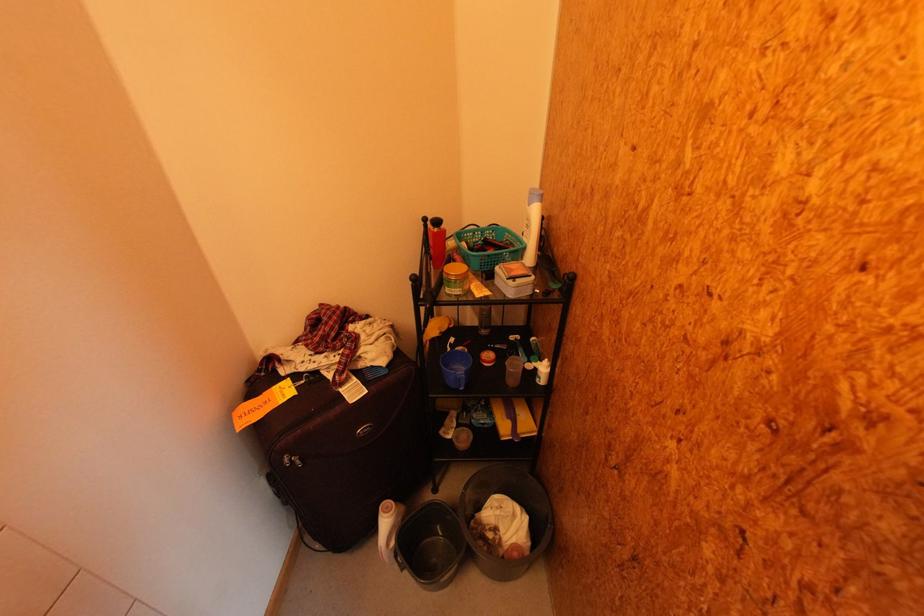
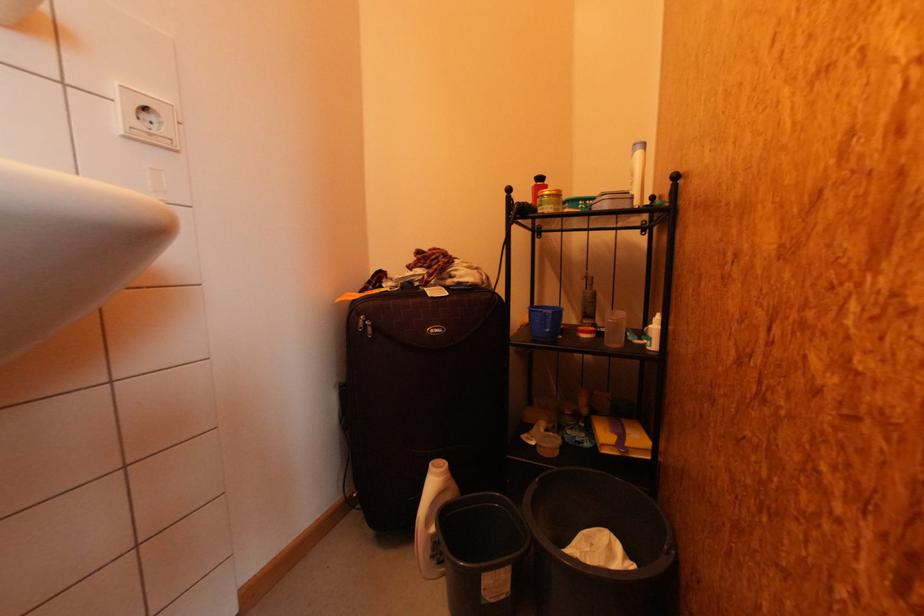
Based on the continuous images, in which direction is the camera rotating?

The rotation direction of the camera is left-up.